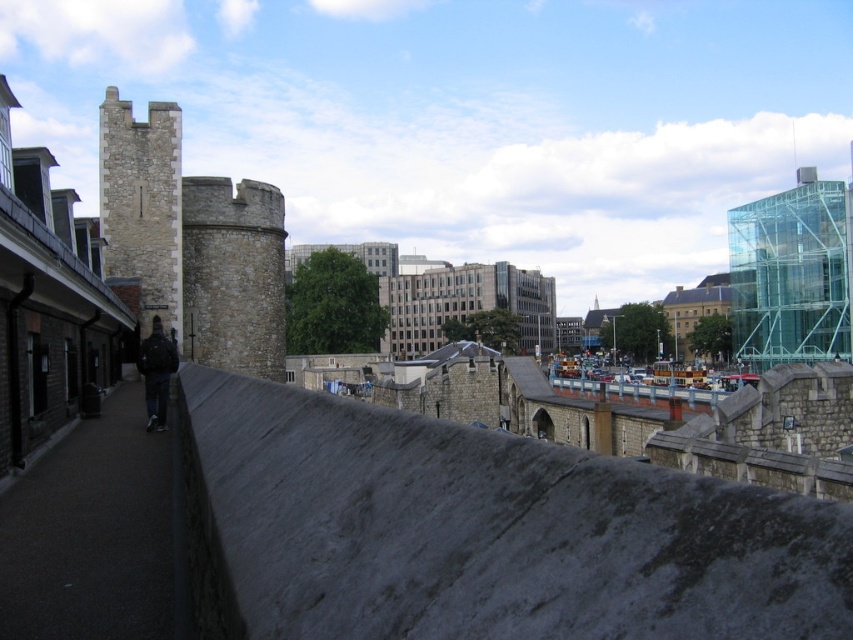
Who is more forward, [195,252] or [173,349]?

Point [173,349]

Between stone tower at left and dark blue jacket at center, which one is positioned lower?

dark blue jacket at center is below.

Image resolution: width=853 pixels, height=640 pixels. What do you see at coordinates (192, 241) in the screenshot?
I see `stone tower at left` at bounding box center [192, 241].

The image size is (853, 640). What are the coordinates of `stone tower at left` in the screenshot? It's located at (192, 241).

Is stone tower at left bigger than light beige stone tower at left?

Correct, stone tower at left is larger in size than light beige stone tower at left.

Is point (225, 342) farther from camera compared to point (97, 166)?

Yes, it is.

Locate an element on the screen. Image resolution: width=853 pixels, height=640 pixels. stone tower at left is located at coordinates (192, 241).

Is dark gray concrete sidewalk at lower left positioned before stone tower at left?

Yes.

Is point (64, 481) more distant than point (117, 256)?

No, (64, 481) is closer to viewer.

Image resolution: width=853 pixels, height=640 pixels. What are the coordinates of `dark gray concrete sidewalk at lower left` in the screenshot? It's located at (91, 532).